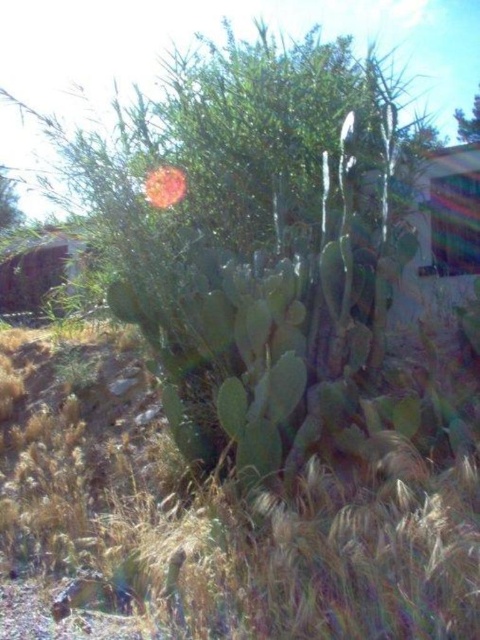
Is green grass at center wider than smooth pink flower at center?

No, green grass at center is not wider than smooth pink flower at center.

Between green grass at center and smooth pink flower at center, which one appears on the right side from the viewer's perspective?

Positioned to the right is green grass at center.

Who is more distant from viewer, [107,388] or [164,182]?

Point [107,388]

The image size is (480, 640). Identify the location of green grass at center. (216, 516).